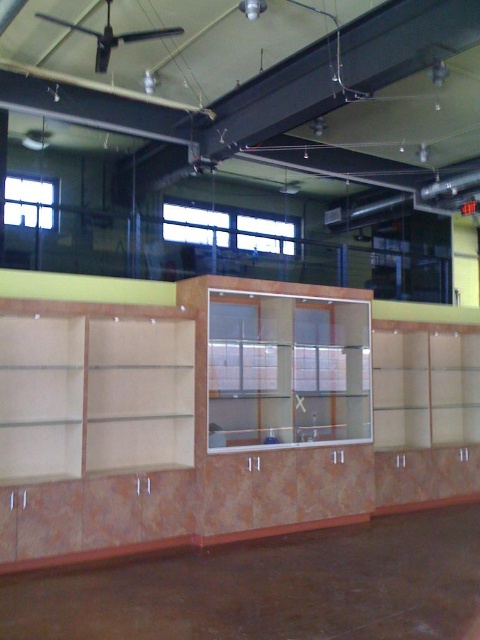
You are an interior designer trying to arrange furniture in the store. You have two shelves to place in the center area. The light brown marble bookshelf at center and the matte wood shelf at center. Which one takes up less space?

The light brown marble bookshelf at center occupies less space than the matte wood shelf at center, so it takes up less space.

You are arranging items in the store and need to place a decorative vase on the shelf. Which shelf, the clear glass shelf at center or the matte wood shelf at center, is positioned to the left side of the other?

The clear glass shelf at center is to the left of the matte wood shelf at center.

You are an interior designer planning to place a large potted plant that requires 2 meters of space. Based on the scene, which object between the light brown marble bookshelf at center and the clear glass shelf at center would be more suitable for placing the plant?

The clear glass shelf at center is larger in size compared to the light brown marble bookshelf at center, so it would be more suitable for placing the large potted plant that requires 2 meters of space.